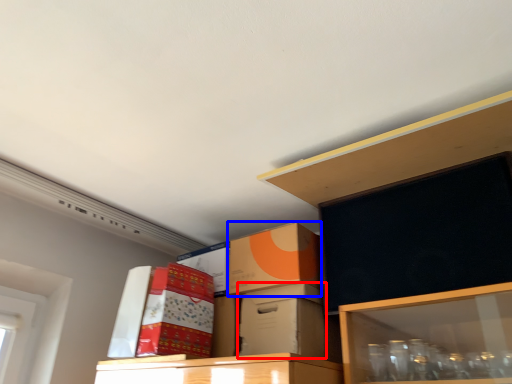
Question: Among these objects, which one is nearest to the camera, box (highlighted by a red box) or box (highlighted by a blue box)?

Choices:
 (A) box
 (B) box

Answer: (A)